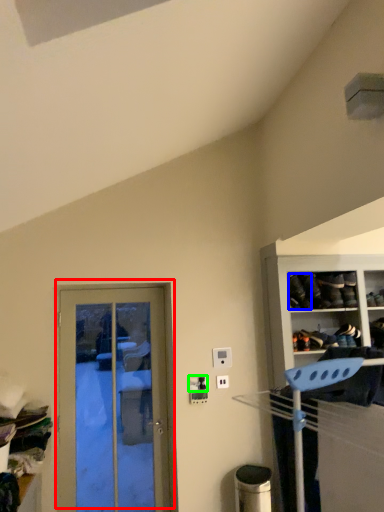
Question: Which object is positioned farthest from door (highlighted by a red box)? Select from shoe (highlighted by a blue box) and electric outlet (highlighted by a green box).

Choices:
 (A) shoe
 (B) electric outlet

Answer: (A)